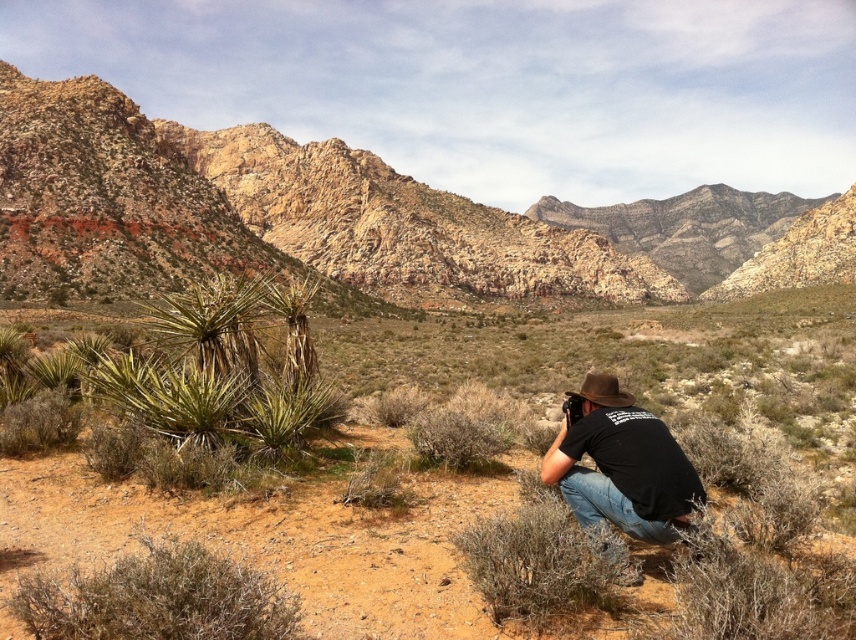
Can you confirm if green shrubs at center is positioned below rugged rock formation at upper left?

Yes.

Between green shrubs at center and rugged rock formation at upper left, which one is positioned higher?

rugged rock formation at upper left

The height and width of the screenshot is (640, 856). What do you see at coordinates (465, 545) in the screenshot?
I see `green shrubs at center` at bounding box center [465, 545].

The width and height of the screenshot is (856, 640). In order to click on green shrubs at center in this screenshot , I will do `click(465, 545)`.

Does dry shrub at lower left have a greater height compared to brown felt cowboy hat at center?

No, dry shrub at lower left is not taller than brown felt cowboy hat at center.

Based on the photo, between dry shrub at lower left and brown felt cowboy hat at center, which one appears on the right side from the viewer's perspective?

Positioned to the right is brown felt cowboy hat at center.

Between point (64, 611) and point (602, 381), which one is positioned in front?

Point (64, 611) is more forward.

Locate an element on the screen. This screenshot has height=640, width=856. dry shrub at lower left is located at coordinates (158, 598).

Does green shrubs at center appear over dry shrub at lower left?

Indeed, green shrubs at center is positioned over dry shrub at lower left.

Does green shrubs at center have a lesser height compared to dry shrub at lower left?

No.

Is point (702, 598) farther from viewer compared to point (103, 602)?

Yes.

Where is `green shrubs at center`? The width and height of the screenshot is (856, 640). green shrubs at center is located at coordinates (465, 545).